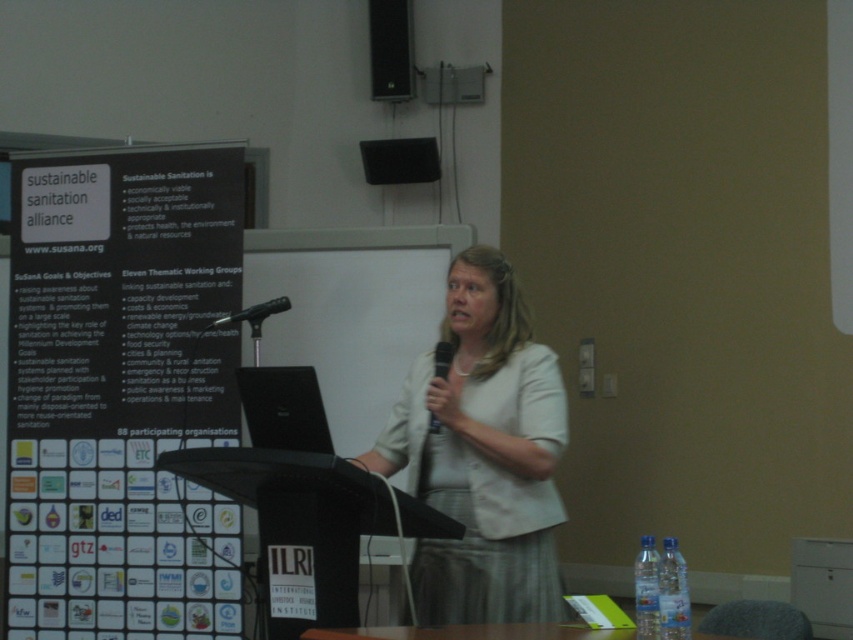
Measure the distance from black matte microphone at center to black plastic microphone at center.

black matte microphone at center is 27.90 inches away from black plastic microphone at center.

Does black matte microphone at center have a larger size compared to black plastic microphone at center?

Yes.

Is point (245, 317) positioned after point (438, 362)?

Yes, point (245, 317) is behind point (438, 362).

Identify the location of black matte microphone at center. (254, 314).

Does white fabric at center appear on the right side of black plastic microphone at center?

Correct, you'll find white fabric at center to the right of black plastic microphone at center.

Is point (489, 570) closer to camera compared to point (430, 429)?

That is False.

In order to click on white fabric at center in this screenshot , I will do `click(483, 456)`.

Does matte black speaker at upper center have a greater width compared to black matte microphone at center?

Yes.

Does matte black speaker at upper center have a greater height compared to black matte microphone at center?

Yes, matte black speaker at upper center is taller than black matte microphone at center.

Who is more distant from viewer, (395, 150) or (263, 305)?

The point (395, 150) is behind.

Locate an element on the screen. This screenshot has height=640, width=853. matte black speaker at upper center is located at coordinates (399, 161).